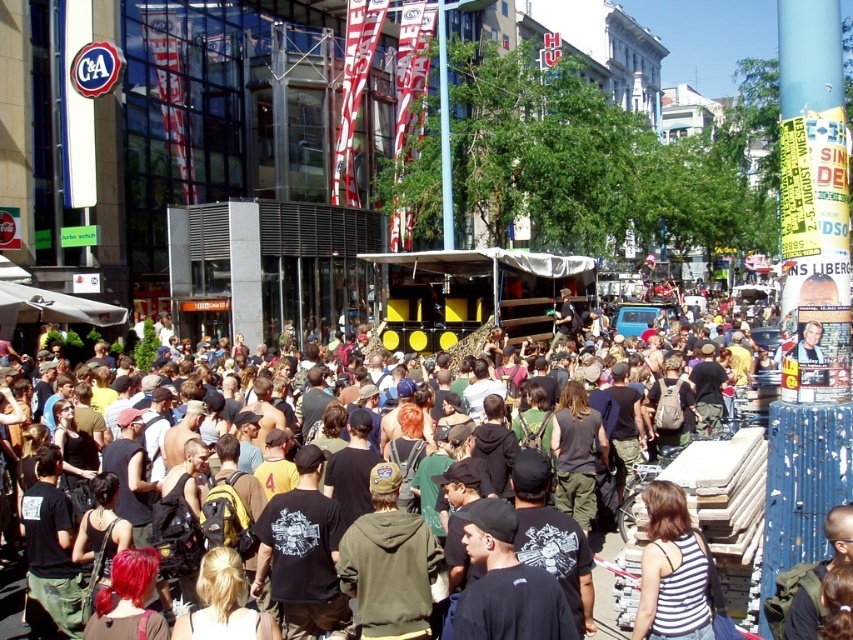
Question: Among these objects, which one is nearest to the camera?

Choices:
 (A) black cotton crowd at center
 (B) dark green backpack at center

Answer: (B)

Question: Is white striped tank top at lower center further to camera compared to black cotton crowd at center?

Choices:
 (A) no
 (B) yes

Answer: (A)

Question: Which point is farther to the camera?

Choices:
 (A) green hoodie at center
 (B) dark green backpack at center
 (C) white striped tank top at lower center

Answer: (A)

Question: Does green hoodie at center have a greater width compared to dark green backpack at center?

Choices:
 (A) no
 (B) yes

Answer: (A)

Question: Which point is farther to the camera?

Choices:
 (A) [13, 609]
 (B) [367, 552]
 (C) [701, 557]

Answer: (A)

Question: Is white striped tank top at lower center positioned at the back of black cotton crowd at center?

Choices:
 (A) yes
 (B) no

Answer: (B)